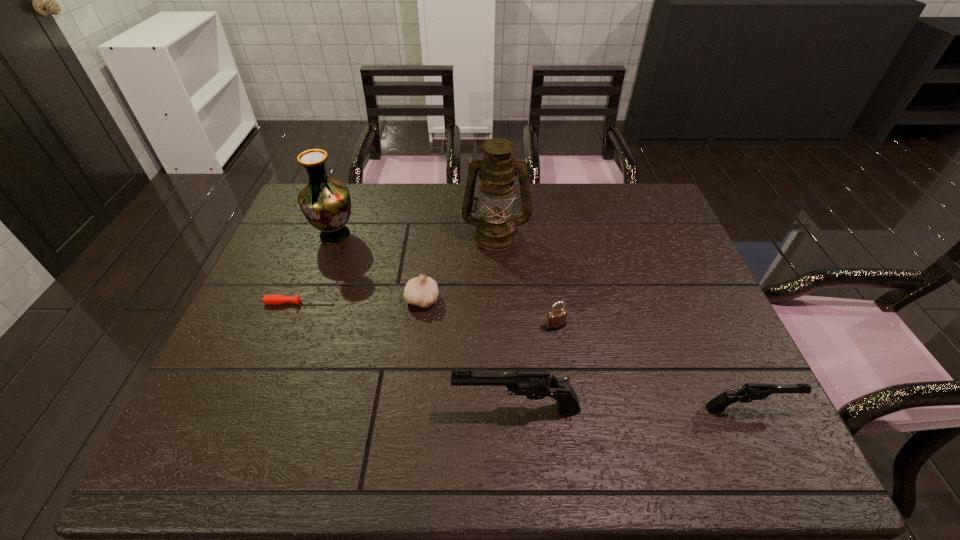
Considering the uniform spacing of guns, where should an additional gun be positioned on the left? Please locate a free spot. Please provide its 2D coordinates. Your answer should be formatted as a tuple, i.e. [(x, y)], where the tuple contains the x and y coordinates of a point satisfying the conditions above.

[(284, 408)]